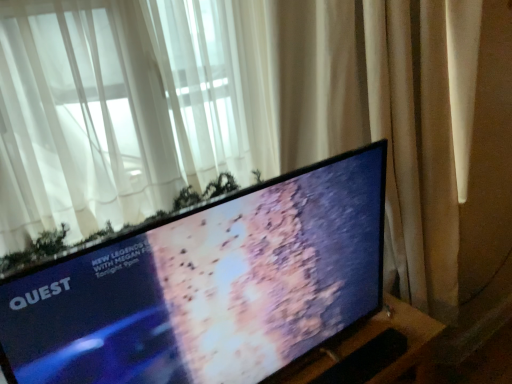
Question: Is matte black tv at center bigger than beige fabric curtain at right, which is the 1th curtain in right-to-left order?

Choices:
 (A) no
 (B) yes

Answer: (A)

Question: Is matte black tv at center smaller than beige fabric curtain at right, which is the 1th curtain in right-to-left order?

Choices:
 (A) yes
 (B) no

Answer: (A)

Question: From the image's perspective, is matte black tv at center beneath beige fabric curtain at right, the second curtain in the left-to-right sequence?

Choices:
 (A) yes
 (B) no

Answer: (A)

Question: Is matte black tv at center positioned far away from beige fabric curtain at right, the second curtain in the left-to-right sequence?

Choices:
 (A) yes
 (B) no

Answer: (B)

Question: Considering the relative positions of matte black tv at center and beige fabric curtain at right, which is the 1th curtain in right-to-left order, in the image provided, is matte black tv at center to the right of beige fabric curtain at right, which is the 1th curtain in right-to-left order, from the viewer's perspective?

Choices:
 (A) no
 (B) yes

Answer: (A)

Question: Is matte black tv at center facing towards beige fabric curtain at right, the second curtain in the left-to-right sequence?

Choices:
 (A) yes
 (B) no

Answer: (B)

Question: Can you confirm if matte black tv at center is positioned to the right of white sheer curtain at upper left, the 2th curtain viewed from the right?

Choices:
 (A) yes
 (B) no

Answer: (A)

Question: Can you confirm if matte black tv at center is thinner than white sheer curtain at upper left, the first curtain when ordered from left to right?

Choices:
 (A) no
 (B) yes

Answer: (B)

Question: Does matte black tv at center turn towards white sheer curtain at upper left, the first curtain when ordered from left to right?

Choices:
 (A) yes
 (B) no

Answer: (B)

Question: From the image's perspective, would you say matte black tv at center is positioned over white sheer curtain at upper left, the first curtain when ordered from left to right?

Choices:
 (A) no
 (B) yes

Answer: (A)

Question: Is matte black tv at center far from white sheer curtain at upper left, the 2th curtain viewed from the right?

Choices:
 (A) no
 (B) yes

Answer: (A)

Question: From the image's perspective, would you say matte black tv at center is shown under white sheer curtain at upper left, the first curtain when ordered from left to right?

Choices:
 (A) yes
 (B) no

Answer: (A)

Question: Can white sheer curtain at upper left, the first curtain when ordered from left to right, be found inside black matte keyboard at lower center?

Choices:
 (A) yes
 (B) no

Answer: (B)